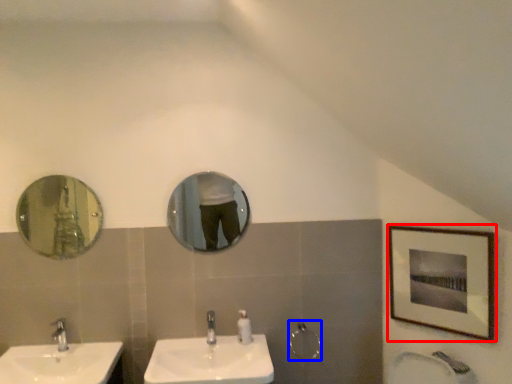
Question: Which object appears closest to the camera in this image, picture frame (highlighted by a red box) or shower (highlighted by a blue box)?

Choices:
 (A) picture frame
 (B) shower

Answer: (A)